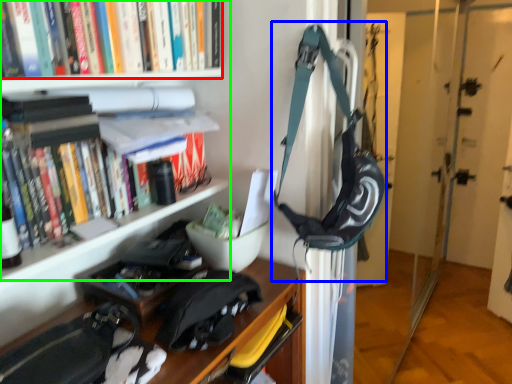
Question: Estimate the real-world distances between objects in this image. Which object is closer to book (highlighted by a red box), shoulder bag (highlighted by a blue box) or bookcase (highlighted by a green box)?

Choices:
 (A) shoulder bag
 (B) bookcase

Answer: (B)